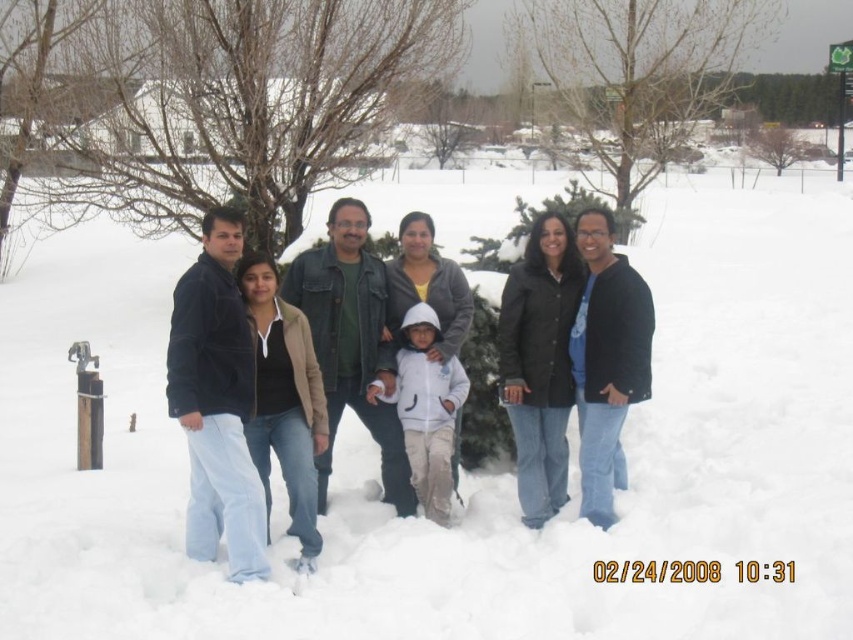
Question: Is dark blue jacket at center to the right of black matte jacket at right from the viewer's perspective?

Choices:
 (A) no
 (B) yes

Answer: (A)

Question: Which point is closer to the camera?

Choices:
 (A) (602, 298)
 (B) (228, 280)

Answer: (B)

Question: Can you confirm if dark blue jacket at center is bigger than black matte jacket at right?

Choices:
 (A) no
 (B) yes

Answer: (B)

Question: Which of the following is the farthest from the observer?

Choices:
 (A) dark blue jacket at center
 (B) black matte jacket at right

Answer: (B)

Question: Which object is farther from the camera taking this photo?

Choices:
 (A) black matte jacket at right
 (B) dark blue jacket at center

Answer: (A)

Question: Does dark blue jacket at center have a larger size compared to black matte jacket at right?

Choices:
 (A) yes
 (B) no

Answer: (A)